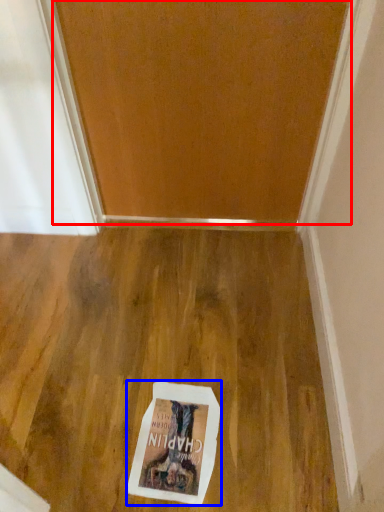
Question: Among these objects, which one is farthest to the camera, door (highlighted by a red box) or postcard (highlighted by a blue box)?

Choices:
 (A) door
 (B) postcard

Answer: (B)